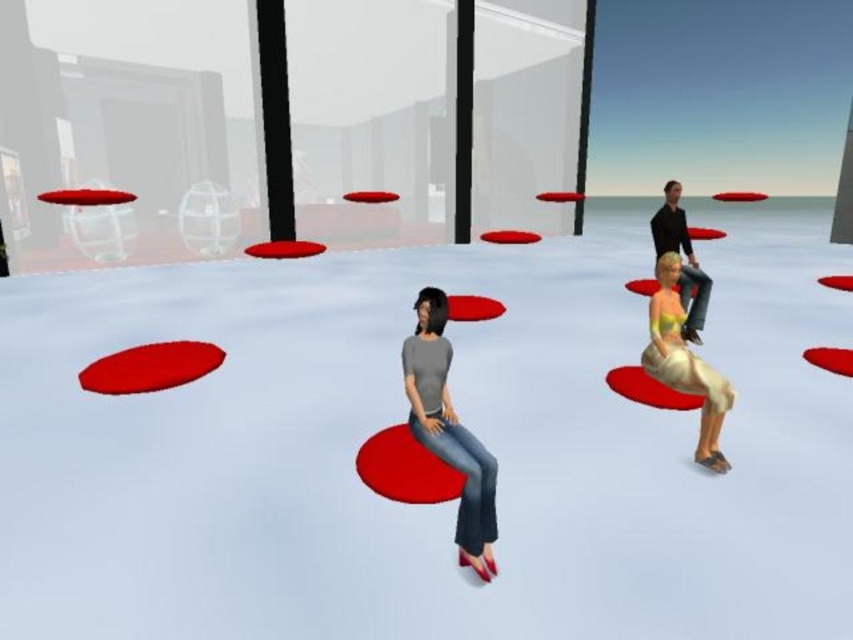
Is beige fabric cushion at right smaller than matte black shirt at upper right?

Yes, beige fabric cushion at right is smaller than matte black shirt at upper right.

Does beige fabric cushion at right have a greater width compared to matte black shirt at upper right?

In fact, beige fabric cushion at right might be narrower than matte black shirt at upper right.

Between point (685, 340) and point (662, 252), which one is positioned in front?

Point (685, 340) is in front.

This screenshot has width=853, height=640. Find the location of `beige fabric cushion at right`. beige fabric cushion at right is located at coordinates (683, 362).

Can you confirm if matte gray shirt at center is thinner than matte black shirt at upper right?

Correct, matte gray shirt at center's width is less than matte black shirt at upper right's.

Which of these two, matte gray shirt at center or matte black shirt at upper right, stands shorter?

matte gray shirt at center is shorter.

Describe the element at coordinates (450, 432) in the screenshot. This screenshot has height=640, width=853. I see `matte gray shirt at center` at that location.

Identify the location of matte gray shirt at center. (450, 432).

Is matte gray shirt at center taller than beige fabric cushion at right?

Incorrect, matte gray shirt at center's height is not larger of beige fabric cushion at right's.

Is matte gray shirt at center to the right of beige fabric cushion at right from the viewer's perspective?

In fact, matte gray shirt at center is to the left of beige fabric cushion at right.

Which is behind, point (438, 353) or point (672, 364)?

Point (672, 364)

You are a GUI agent. You are given a task and a screenshot of the screen. Output one action in this format:
    pyautogui.click(x=<x>, y=<y>)
    Task: Click on the matte gray shirt at center
    The image size is (853, 640).
    Given the screenshot: What is the action you would take?
    click(x=450, y=432)